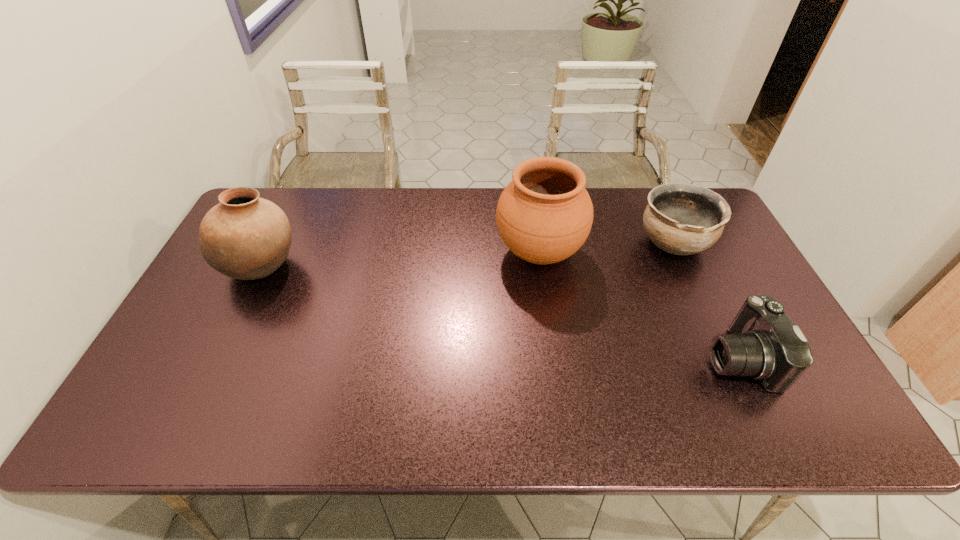
The height and width of the screenshot is (540, 960). I want to click on free point between the second pottery from left to right and the shortest pottery, so click(x=606, y=248).

Locate an element on the screen. free area in between the rightmost pottery and the camera is located at coordinates (706, 300).

Locate an element on the screen. The image size is (960, 540). empty location between the leftmost object and the rightmost pottery is located at coordinates (468, 254).

Image resolution: width=960 pixels, height=540 pixels. I want to click on vacant space in between the shortest pottery and the leftmost object, so click(468, 254).

I want to click on vacant space that is in between the nearest object and the leftmost pottery, so click(500, 312).

This screenshot has width=960, height=540. Find the location of `free point between the leftmost pottery and the camera`. free point between the leftmost pottery and the camera is located at coordinates (500, 312).

At what (x,y) coordinates should I click in order to perform the action: click on vacant area between the camera and the second pottery from left to right. Please return your answer as a coordinate pair (x, y). The image size is (960, 540). Looking at the image, I should click on (638, 305).

Where is `blank region between the leftmost object and the camera`? This screenshot has height=540, width=960. blank region between the leftmost object and the camera is located at coordinates (500, 312).

What are the coordinates of `free space between the shortest pottery and the leftmost pottery` in the screenshot? It's located at (468, 254).

Select which object is the closest to the leftmost object. Please provide its 2D coordinates. Your answer should be formatted as a tuple, i.e. [(x, y)], where the tuple contains the x and y coordinates of a point satisfying the conditions above.

[(544, 215)]